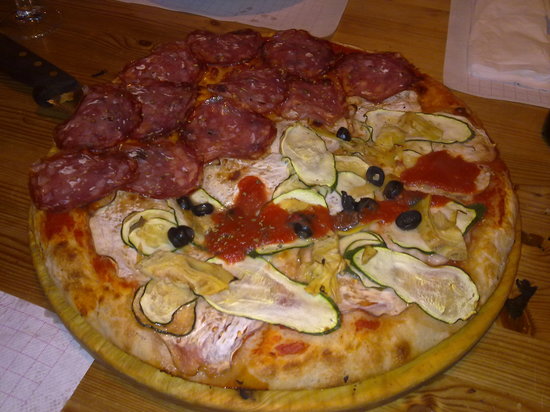
Identify the location of knife handle. This screenshot has height=412, width=550. (44, 90).